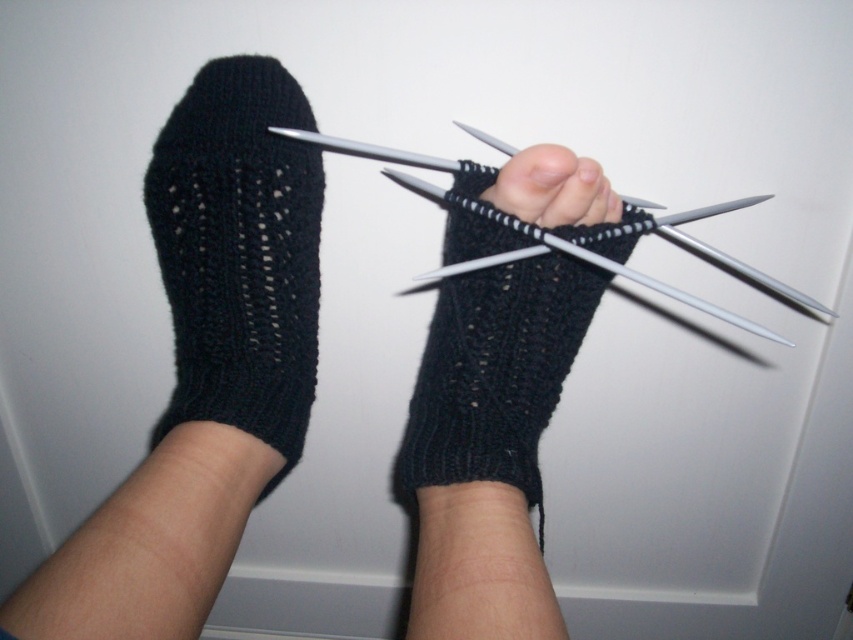
You are a photographer trying to capture a closeup of the metallic silver knitting needles at center and the matte black sock at center. Since the background is plain, you want to ensure that both objects are clearly visible. Which object should you focus on first to make sure it appears sharp in the photo?

You should focus on the metallic silver knitting needles at center first because it is in front of the matte black sock at center, so focusing on the front object ensures both will be in focus if they are within the depth of field.

Where is the black knitted sock at left located in the image?

The black knitted sock at left is located at point (239, 252).

You are a photographer trying to capture the metallic silver knitting needles at center and the matte black sock at center in a single frame. Based on their positions, which object should you adjust your camera angle to focus on first if you want to include both in your shot?

The metallic silver knitting needles at center is positioned on the right side of matte black sock at center, so you should focus on the matte black sock at center first to ensure both objects are in frame.